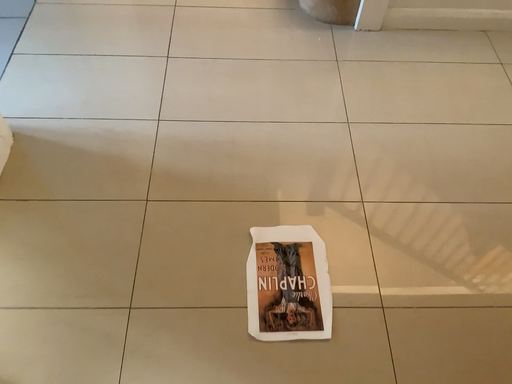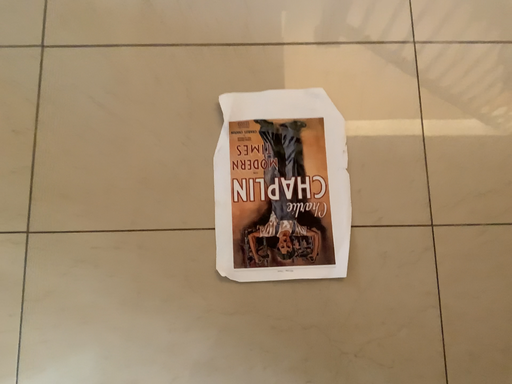
Question: Which way did the camera rotate in the video?

Choices:
 (A) rotated upward
 (B) rotated downward

Answer: (B)